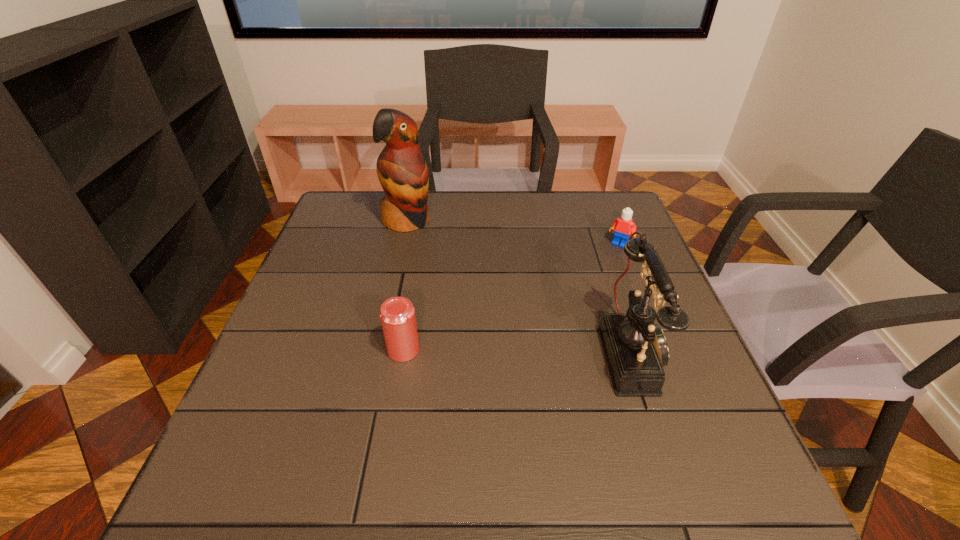
This screenshot has width=960, height=540. In order to click on free space that satisfies the following two spatial constraints: 1. on the front side of the second tallest object; 2. on the dial of the beer can in this screenshot , I will do `click(403, 352)`.